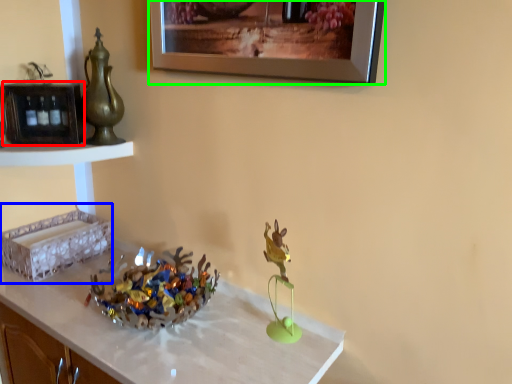
Question: Considering the real-world distances, which object is farthest from shelf (highlighted by a red box)? shelf (highlighted by a blue box) or picture frame (highlighted by a green box)?

Choices:
 (A) shelf
 (B) picture frame

Answer: (B)